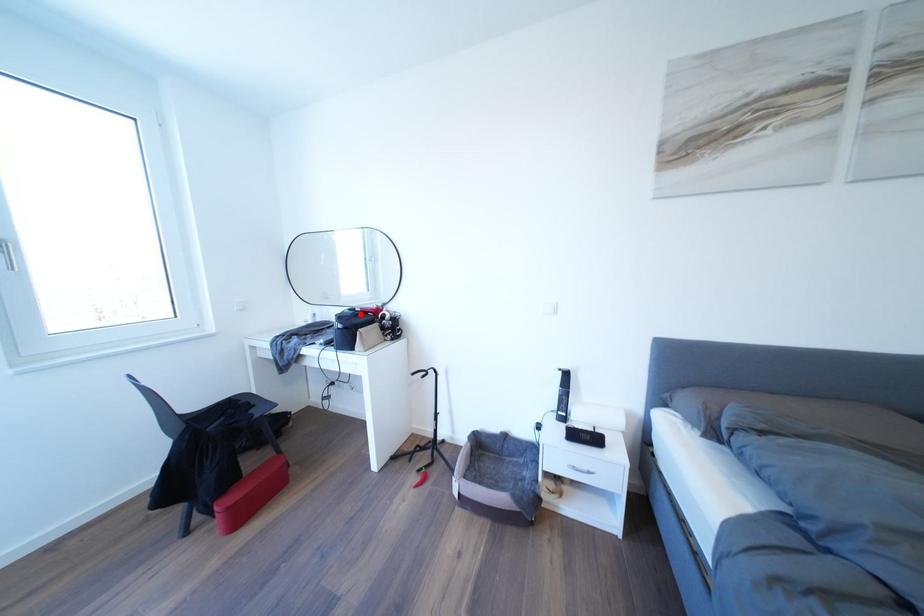
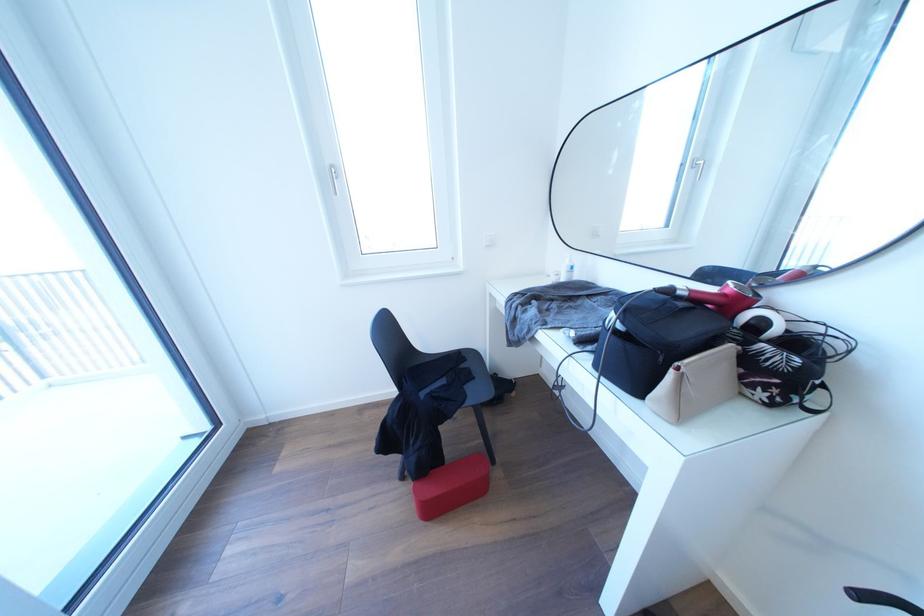
Where in the second image is the point corresponding to the highlighted location from the first image?

(675, 296)